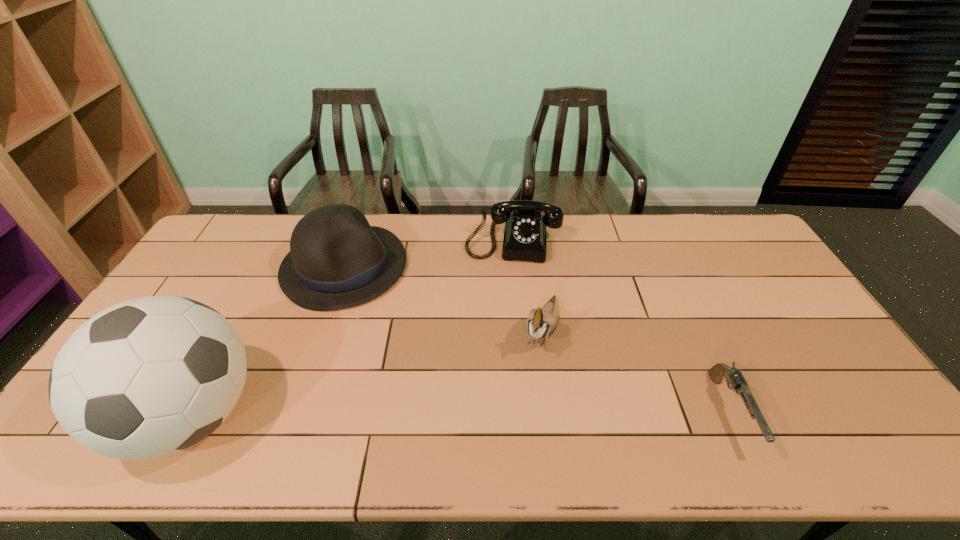
I want to click on object present at the left edge, so [148, 377].

Where is `object that is positioned at the near left corner`? Image resolution: width=960 pixels, height=540 pixels. object that is positioned at the near left corner is located at coordinates (148, 377).

Image resolution: width=960 pixels, height=540 pixels. In the image, there is a desktop. Find the location of `vacant space at the far edge`. vacant space at the far edge is located at coordinates (379, 218).

I want to click on vacant region at the near edge of the desktop, so click(x=447, y=401).

Find the location of `vacant space at the far right corner`. vacant space at the far right corner is located at coordinates (725, 246).

This screenshot has height=540, width=960. Identify the location of vacant area that lies between the gun and the bird. (636, 371).

Identify the location of vacant area between the second shortest object and the bowler hat. This screenshot has width=960, height=540. (428, 253).

At what (x,y) coordinates should I click in order to perform the action: click on unoccupied area between the bird and the telephone. Please return your answer as a coordinate pair (x, y). This screenshot has width=960, height=540. Looking at the image, I should click on (527, 285).

Where is `free space between the soccer ball and the fourth tallest object`? free space between the soccer ball and the fourth tallest object is located at coordinates (352, 327).

This screenshot has width=960, height=540. Find the location of `free space between the bowler hat and the second shortest object`. free space between the bowler hat and the second shortest object is located at coordinates (428, 253).